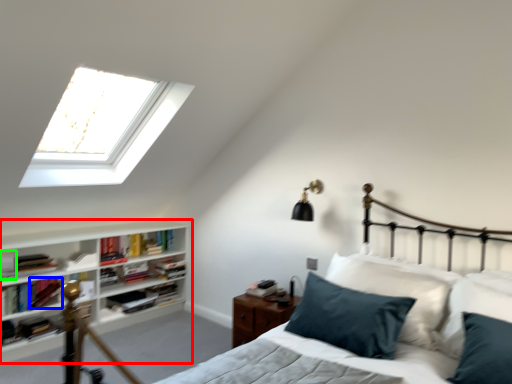
Question: Estimate the real-world distances between objects in this image. Which object is farther from shelf (highlighted by a red box), book (highlighted by a blue box) or book (highlighted by a green box)?

Choices:
 (A) book
 (B) book

Answer: (B)